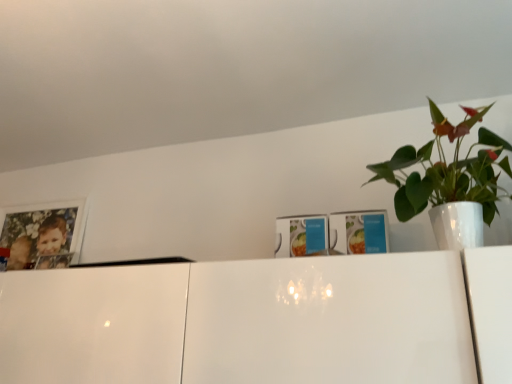
Question: From the image's perspective, relative to wooden photo frame at upper left, is green glossy plant at upper right above or below?

Choices:
 (A) above
 (B) below

Answer: (A)

Question: Is green glossy plant at upper right taller or shorter than wooden photo frame at upper left?

Choices:
 (A) short
 (B) tall

Answer: (B)

Question: From a real-world perspective, relative to wooden photo frame at upper left, is green glossy plant at upper right vertically above or below?

Choices:
 (A) below
 (B) above

Answer: (A)

Question: From the image's perspective, relative to green glossy plant at upper right, is wooden photo frame at upper left above or below?

Choices:
 (A) above
 (B) below

Answer: (B)

Question: Is point (12, 221) closer or farther from the camera than point (432, 170)?

Choices:
 (A) closer
 (B) farther

Answer: (B)

Question: Looking at their shapes, would you say wooden photo frame at upper left is wider or thinner than green glossy plant at upper right?

Choices:
 (A) wide
 (B) thin

Answer: (B)

Question: Considering the positions of wooden photo frame at upper left and green glossy plant at upper right in the image, is wooden photo frame at upper left bigger or smaller than green glossy plant at upper right?

Choices:
 (A) big
 (B) small

Answer: (B)